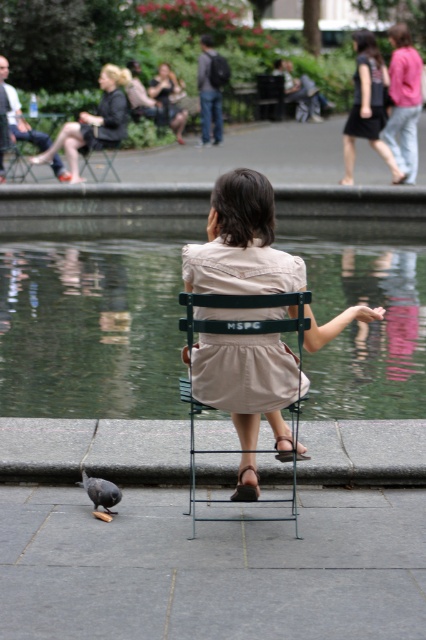
You are a photographer planning to take a portrait of the girl sitting on the metallic green chair at center. You notice a pink cotton sweater at upper right hanging nearby. Since you want to ensure the sweater doesn not block the girl in your shot, can you determine if the sweater is taller than the chair?

The metallic green chair at center is much taller as pink cotton sweater at upper right, so the sweater is shorter than the chair. Therefore, the sweater will not block the girl in your shot.

You are a photographer trying to capture the entire scene of the beige fabric dress at center and the metallic green chair at center in a single shot. Considering their sizes, which object will require you to adjust your camera angle more to ensure both are fully visible?

The metallic green chair at center occupies more space than the beige fabric dress at center, so you will need to adjust your camera angle more to accommodate the larger size of the metallic green chair at center to ensure both are fully visible.

You are a photographer planning to take a photo of the green reflective water at center and the dark brown dress at upper right. Which object should you focus on first if you want to capture both in the frame without moving the camera?

The dark brown dress at upper right should be focused on first because it is larger and will require more attention to detail to ensure it is sharp and in focus, while the smaller green reflective water at center can be captured in the background or foreground naturally.